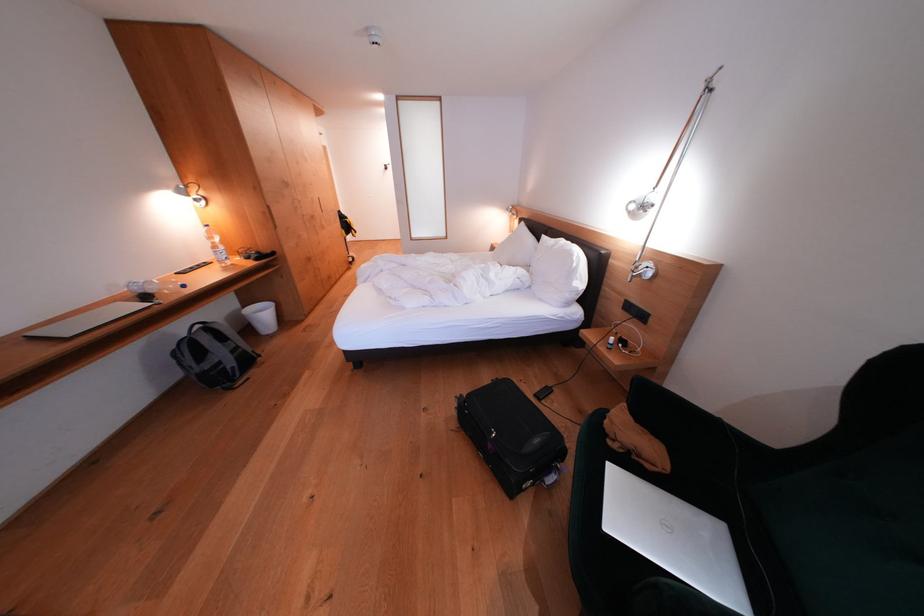
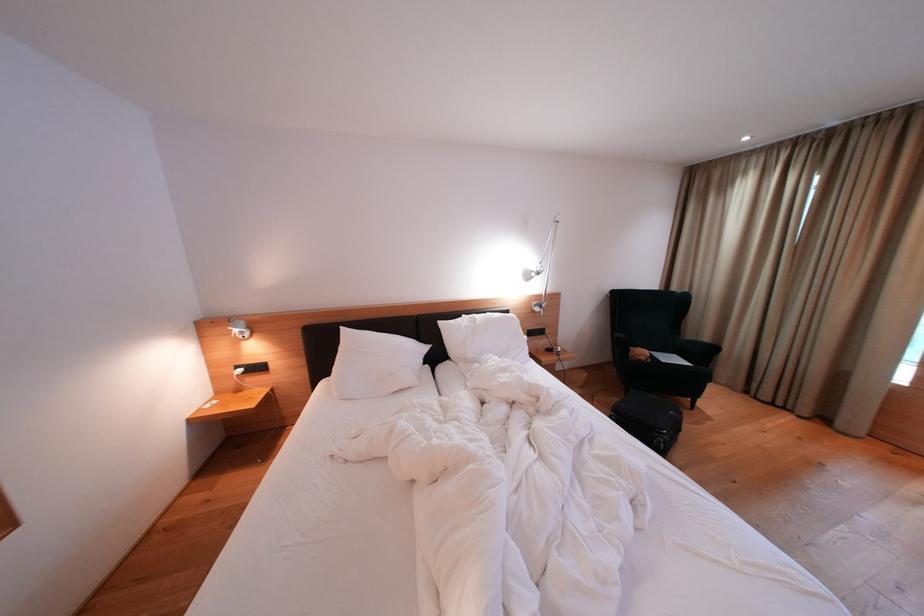
Where in the second image is the point corresponding to (551,241) from the first image?

(447, 328)